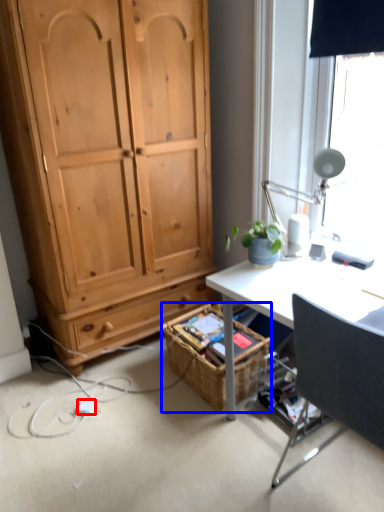
Question: Which object is further to the camera taking this photo, power outlet (highlighted by a red box) or picnic basket (highlighted by a blue box)?

Choices:
 (A) power outlet
 (B) picnic basket

Answer: (A)